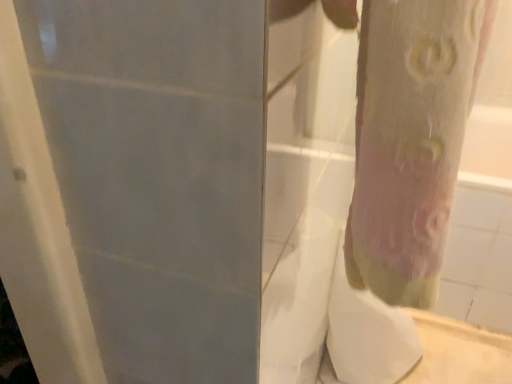
Question: Is white sheer fabric at lower right taller or shorter than pink fabric tree trunk at right?

Choices:
 (A) tall
 (B) short

Answer: (A)

Question: Relative to pink fabric tree trunk at right, is white sheer fabric at lower right in front or behind?

Choices:
 (A) front
 (B) behind

Answer: (B)

Question: Is white sheer fabric at lower right inside or outside of pink fabric tree trunk at right?

Choices:
 (A) inside
 (B) outside

Answer: (B)

Question: In the image, is pink fabric tree trunk at right positioned in front of or behind white sheer fabric at lower right?

Choices:
 (A) behind
 (B) front

Answer: (B)

Question: From the image's perspective, is pink fabric tree trunk at right positioned above or below white sheer fabric at lower right?

Choices:
 (A) above
 (B) below

Answer: (A)

Question: In the image, is pink fabric tree trunk at right on the left side or the right side of white sheer fabric at lower right?

Choices:
 (A) right
 (B) left

Answer: (B)

Question: From a real-world perspective, is pink fabric tree trunk at right physically located above or below white sheer fabric at lower right?

Choices:
 (A) below
 (B) above

Answer: (B)